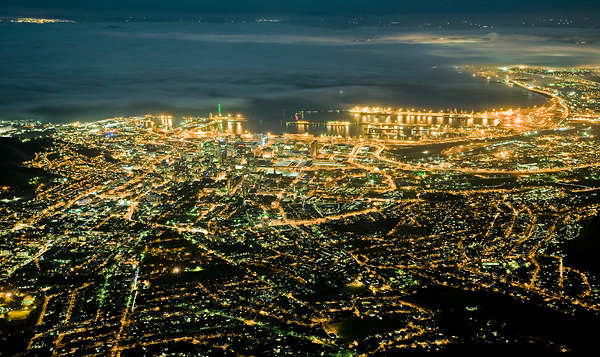
I want to click on red lights, so click(x=508, y=125), click(x=510, y=111), click(x=497, y=119), click(x=477, y=122), click(x=528, y=121).